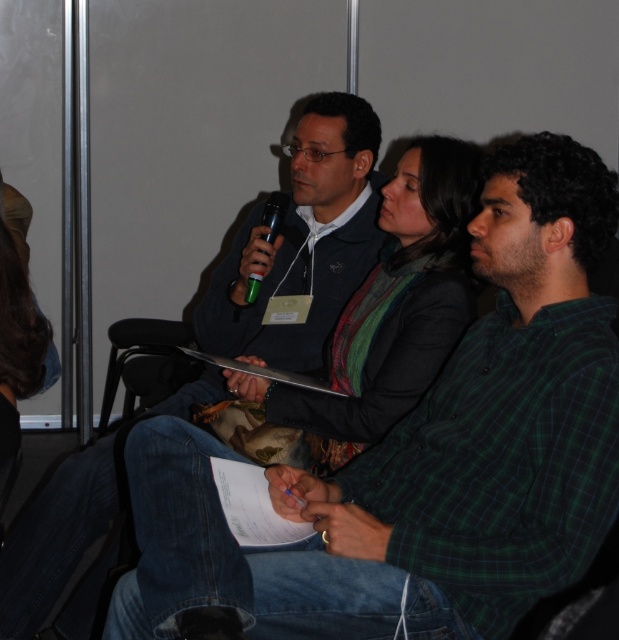
Question: Which of the following is the farthest from the observer?

Choices:
 (A) green plastic microphone at center
 (B) green plaid shirt at center

Answer: (A)

Question: Which point is closer to the camera taking this photo?

Choices:
 (A) (413, 593)
 (B) (100, 564)
 (C) (275, 220)

Answer: (A)

Question: Can you confirm if green plaid shirt at center is positioned above green plastic microphone at center?

Choices:
 (A) no
 (B) yes

Answer: (A)

Question: Is green plaid shirt at center above dark blue jeans at center?

Choices:
 (A) yes
 (B) no

Answer: (B)

Question: Which of the following is the closest to the observer?

Choices:
 (A) dark blue jeans at center
 (B) green plaid shirt at center

Answer: (B)

Question: Is dark blue jeans at center positioned before green plastic microphone at center?

Choices:
 (A) no
 (B) yes

Answer: (B)